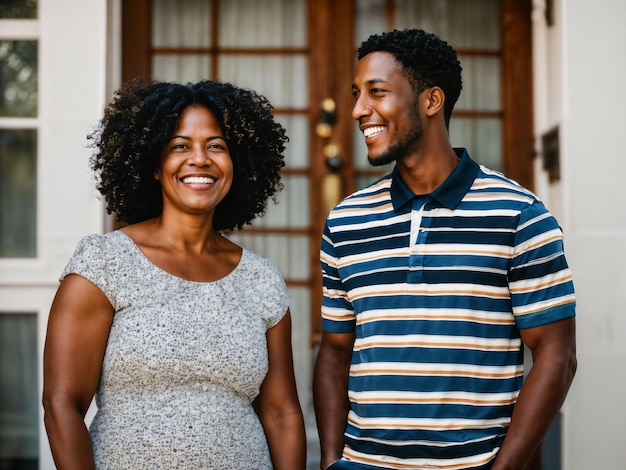
The height and width of the screenshot is (470, 626). Find the location of `doors`. doors is located at coordinates (295, 209), (351, 162).